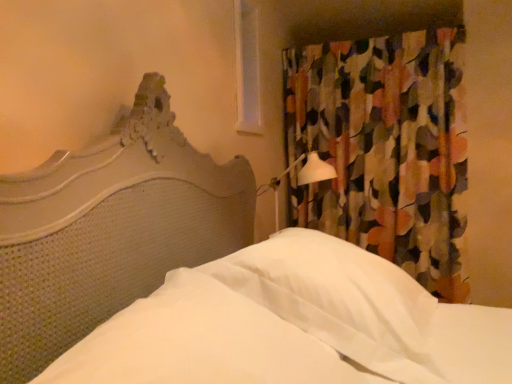
Question: Is multicolored fabric curtain at upper right shorter than white fabric sheet at center?

Choices:
 (A) no
 (B) yes

Answer: (A)

Question: Considering the relative sizes of multicolored fabric curtain at upper right and white fabric sheet at center in the image provided, is multicolored fabric curtain at upper right wider than white fabric sheet at center?

Choices:
 (A) no
 (B) yes

Answer: (A)

Question: Does multicolored fabric curtain at upper right lie behind white fabric sheet at center?

Choices:
 (A) yes
 (B) no

Answer: (A)

Question: Can you confirm if multicolored fabric curtain at upper right is taller than white fabric sheet at center?

Choices:
 (A) no
 (B) yes

Answer: (B)

Question: From a real-world perspective, is multicolored fabric curtain at upper right positioned under white fabric sheet at center based on gravity?

Choices:
 (A) yes
 (B) no

Answer: (B)

Question: Can you confirm if multicolored fabric curtain at upper right is positioned to the left of white fabric sheet at center?

Choices:
 (A) no
 (B) yes

Answer: (A)

Question: Does white fabric sheet at center have a lesser width compared to multicolored fabric curtain at upper right?

Choices:
 (A) yes
 (B) no

Answer: (B)

Question: Is white fabric sheet at center not inside multicolored fabric curtain at upper right?

Choices:
 (A) yes
 (B) no

Answer: (A)

Question: Is multicolored fabric curtain at upper right located within white fabric sheet at center?

Choices:
 (A) yes
 (B) no

Answer: (B)

Question: Considering the relative sizes of white fabric sheet at center and multicolored fabric curtain at upper right in the image provided, is white fabric sheet at center shorter than multicolored fabric curtain at upper right?

Choices:
 (A) no
 (B) yes

Answer: (B)

Question: Is white fabric sheet at center positioned far away from multicolored fabric curtain at upper right?

Choices:
 (A) yes
 (B) no

Answer: (A)

Question: Is white fabric sheet at center smaller than multicolored fabric curtain at upper right?

Choices:
 (A) yes
 (B) no

Answer: (A)

Question: Considering the relative positions of multicolored fabric curtain at upper right and white plastic window at upper center in the image provided, is multicolored fabric curtain at upper right in front of white plastic window at upper center?

Choices:
 (A) no
 (B) yes

Answer: (A)